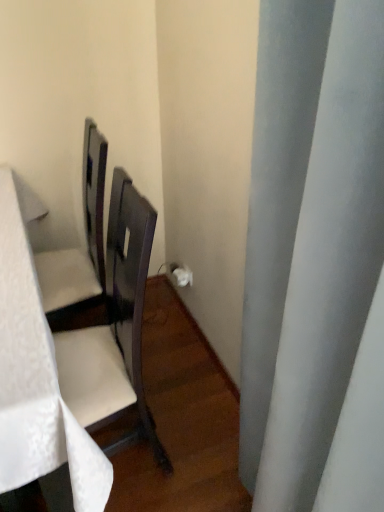
Question: From a real-world perspective, is white matte curtain at right physically below white fabric table at left?

Choices:
 (A) yes
 (B) no

Answer: (B)

Question: From the image's perspective, is white matte curtain at right below white fabric table at left?

Choices:
 (A) yes
 (B) no

Answer: (B)

Question: Is white matte curtain at right at the left side of white fabric table at left?

Choices:
 (A) no
 (B) yes

Answer: (A)

Question: Considering the relative positions of white matte curtain at right and white fabric table at left in the image provided, is white matte curtain at right to the right of white fabric table at left from the viewer's perspective?

Choices:
 (A) yes
 (B) no

Answer: (A)

Question: Can you confirm if white matte curtain at right is smaller than white fabric table at left?

Choices:
 (A) no
 (B) yes

Answer: (B)

Question: From a real-world perspective, is white matte curtain at right located higher than white fabric table at left?

Choices:
 (A) yes
 (B) no

Answer: (A)

Question: Is white fabric table at left smaller than white matte curtain at right?

Choices:
 (A) yes
 (B) no

Answer: (B)

Question: From the image's perspective, is white fabric table at left on white matte curtain at right?

Choices:
 (A) no
 (B) yes

Answer: (A)

Question: From the image's perspective, would you say white fabric table at left is shown under white matte curtain at right?

Choices:
 (A) no
 (B) yes

Answer: (B)

Question: Considering the relative sizes of white fabric table at left and white matte curtain at right in the image provided, is white fabric table at left taller than white matte curtain at right?

Choices:
 (A) no
 (B) yes

Answer: (A)

Question: Can you confirm if white fabric table at left is bigger than white matte curtain at right?

Choices:
 (A) no
 (B) yes

Answer: (B)

Question: From a real-world perspective, does white fabric table at left sit lower than white matte curtain at right?

Choices:
 (A) no
 (B) yes

Answer: (B)

Question: Based on their positions, is white fabric table at left located to the left or right of white matte curtain at right?

Choices:
 (A) right
 (B) left

Answer: (B)